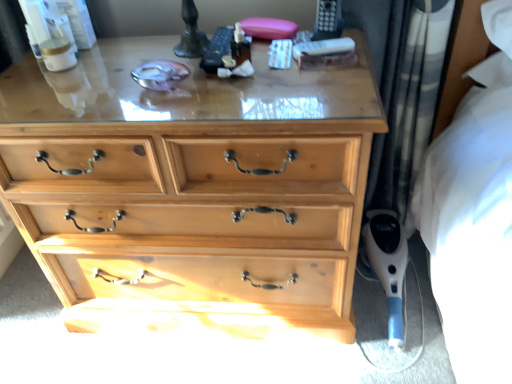
Identify the location of plaid fabric curtain at right. Image resolution: width=512 pixels, height=384 pixels. (x=410, y=94).

The width and height of the screenshot is (512, 384). I want to click on blue plastic vacuum cleaner at lower right, so click(388, 265).

Locate an element on the screen. natural wood chest of drawers at center is located at coordinates (192, 189).

Is point (431, 73) farther from camera compared to point (358, 222)?

Yes, it is.

Can you tell me how much plaid fabric curtain at right and natural wood chest of drawers at center differ in facing direction?

The angular difference between plaid fabric curtain at right and natural wood chest of drawers at center is 2.02 degrees.

Is plaid fabric curtain at right in front of or behind natural wood chest of drawers at center in the image?

In the image, plaid fabric curtain at right appears behind natural wood chest of drawers at center.

Is plaid fabric curtain at right far away from natural wood chest of drawers at center?

No.

Would you consider plaid fabric curtain at right to be distant from blue plastic vacuum cleaner at lower right?

No, plaid fabric curtain at right is not far from blue plastic vacuum cleaner at lower right.

Is plaid fabric curtain at right thinner than blue plastic vacuum cleaner at lower right?

Yes.

In terms of size, does plaid fabric curtain at right appear bigger or smaller than blue plastic vacuum cleaner at lower right?

Considering their sizes, plaid fabric curtain at right takes up more space than blue plastic vacuum cleaner at lower right.

Locate an element on the screen. This screenshot has height=384, width=512. equipment behind the plaid fabric curtain at right is located at coordinates (388, 265).

Between blue plastic vacuum cleaner at lower right and plaid fabric curtain at right, which one has more height?

plaid fabric curtain at right.

Who is smaller, blue plastic vacuum cleaner at lower right or plaid fabric curtain at right?

blue plastic vacuum cleaner at lower right is smaller.

Could you tell me if blue plastic vacuum cleaner at lower right is turned towards natural wood chest of drawers at center?

No, blue plastic vacuum cleaner at lower right is not turned towards natural wood chest of drawers at center.

Which object is positioned more to the left, blue plastic vacuum cleaner at lower right or natural wood chest of drawers at center?

natural wood chest of drawers at center.

How much distance is there between blue plastic vacuum cleaner at lower right and natural wood chest of drawers at center?

blue plastic vacuum cleaner at lower right is 23.89 inches away from natural wood chest of drawers at center.

Considering the positions of point (382, 268) and point (278, 131), is point (382, 268) closer or farther from the camera than point (278, 131)?

Point (382, 268) appears to be farther away from the viewer than point (278, 131).

Is natural wood chest of drawers at center beside plaid fabric curtain at right?

No, natural wood chest of drawers at center is not next to plaid fabric curtain at right.

Is natural wood chest of drawers at center facing away from plaid fabric curtain at right?

No, natural wood chest of drawers at center is not facing the opposite direction of plaid fabric curtain at right.

Considering the relative sizes of natural wood chest of drawers at center and plaid fabric curtain at right in the image provided, is natural wood chest of drawers at center wider than plaid fabric curtain at right?

Indeed, natural wood chest of drawers at center has a greater width compared to plaid fabric curtain at right.

Between point (167, 228) and point (388, 321), which one is positioned behind?

The point (388, 321) is farther from the camera.

Are natural wood chest of drawers at center and blue plastic vacuum cleaner at lower right making contact?

No, natural wood chest of drawers at center is not beside blue plastic vacuum cleaner at lower right.

In terms of height, does natural wood chest of drawers at center look taller or shorter compared to blue plastic vacuum cleaner at lower right?

In the image, natural wood chest of drawers at center appears to be taller than blue plastic vacuum cleaner at lower right.

From the image's perspective, is natural wood chest of drawers at center on top of blue plastic vacuum cleaner at lower right?

Correct, natural wood chest of drawers at center appears higher than blue plastic vacuum cleaner at lower right in the image.

The image size is (512, 384). What are the coordinates of `curtain on the right side of natural wood chest of drawers at center` in the screenshot? It's located at (410, 94).

Image resolution: width=512 pixels, height=384 pixels. I want to click on curtain to the left of blue plastic vacuum cleaner at lower right, so click(410, 94).

Based on the photo, estimate the real-world distances between objects in this image. Which object is closer to blue plastic vacuum cleaner at lower right, natural wood chest of drawers at center or plaid fabric curtain at right?

The object closer to blue plastic vacuum cleaner at lower right is plaid fabric curtain at right.

Looking at this image, based on their spatial positions, is plaid fabric curtain at right or blue plastic vacuum cleaner at lower right further from natural wood chest of drawers at center?

blue plastic vacuum cleaner at lower right.

Looking at the image, which one is located further to plaid fabric curtain at right, blue plastic vacuum cleaner at lower right or natural wood chest of drawers at center?

Based on the image, natural wood chest of drawers at center appears to be further to plaid fabric curtain at right.

Estimate the real-world distances between objects in this image. Which object is further from blue plastic vacuum cleaner at lower right, plaid fabric curtain at right or natural wood chest of drawers at center?

natural wood chest of drawers at center.

Estimate the real-world distances between objects in this image. Which object is further from natural wood chest of drawers at center, blue plastic vacuum cleaner at lower right or plaid fabric curtain at right?

Based on the image, blue plastic vacuum cleaner at lower right appears to be further to natural wood chest of drawers at center.

Which object lies further to the anchor point plaid fabric curtain at right, natural wood chest of drawers at center or blue plastic vacuum cleaner at lower right?

natural wood chest of drawers at center.

Find the location of a particular element. The width and height of the screenshot is (512, 384). curtain situated between natural wood chest of drawers at center and blue plastic vacuum cleaner at lower right from left to right is located at coordinates (410, 94).